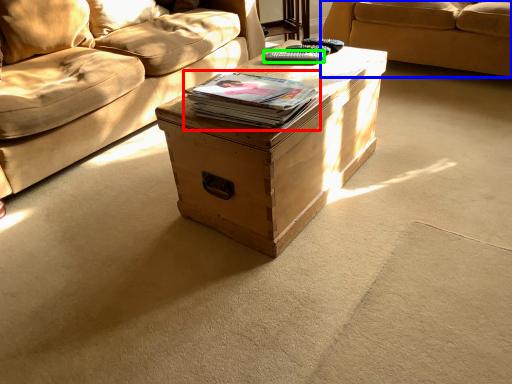
Question: Estimate the real-world distances between objects in this image. Which object is closer to paperback book (highlighted by a red box), studio couch (highlighted by a blue box) or remote (highlighted by a green box)?

Choices:
 (A) studio couch
 (B) remote

Answer: (B)